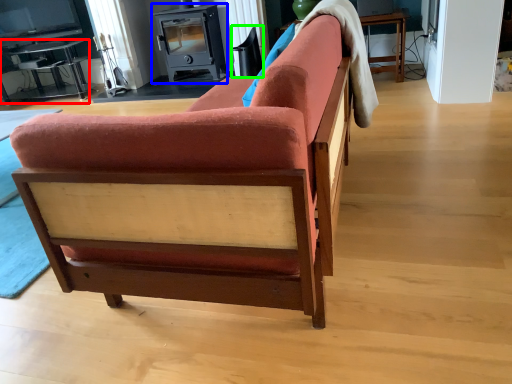
Question: Which object is the closest to the table (highlighted by a red box)? Choose among these: appliance (highlighted by a blue box) or swivel chair (highlighted by a green box).

Choices:
 (A) appliance
 (B) swivel chair

Answer: (A)